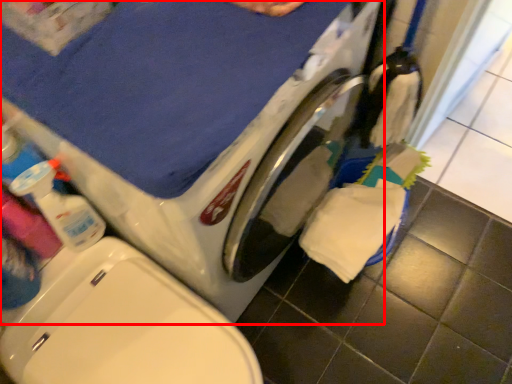
Question: In this image, where is washing machine (annotated by the red box) located relative to cleaning product?

Choices:
 (A) left
 (B) right

Answer: (B)